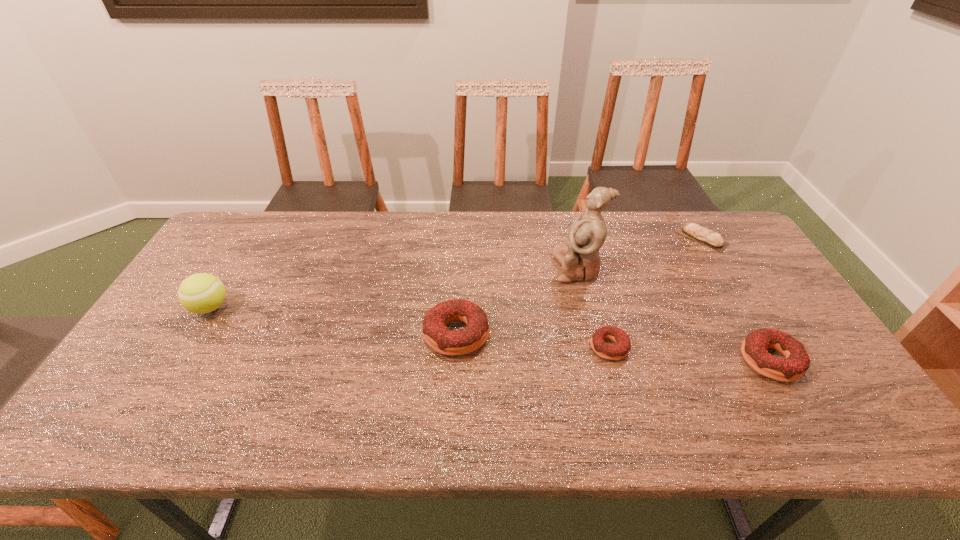
Identify which object is the closest to the shortest doughnut. Please provide its 2D coordinates. Your answer should be formatted as a tuple, i.e. [(x, y)], where the tuple contains the x and y coordinates of a point satisfying the conditions above.

[(579, 258)]

Select which object appears as the closest to the second tallest doughnut. Please provide its 2D coordinates. Your answer should be formatted as a tuple, i.e. [(x, y)], where the tuple contains the x and y coordinates of a point satisfying the conditions above.

[(612, 352)]

Choose which doughnut is the second nearest neighbor to the tallest object. Please provide its 2D coordinates. Your answer should be formatted as a tuple, i.e. [(x, y)], where the tuple contains the x and y coordinates of a point satisfying the conditions above.

[(436, 334)]

Identify which doughnut is the nearest to the shortest doughnut. Please provide its 2D coordinates. Your answer should be formatted as a tuple, i.e. [(x, y)], where the tuple contains the x and y coordinates of a point satisfying the conditions above.

[(436, 334)]

Where is `vacant area that satisfies the following two spatial constraints: 1. on the front-facing side of the tallest object; 2. on the front side of the tennis ball`? The width and height of the screenshot is (960, 540). vacant area that satisfies the following two spatial constraints: 1. on the front-facing side of the tallest object; 2. on the front side of the tennis ball is located at coordinates (588, 307).

Locate an element on the screen. vacant area in the image that satisfies the following two spatial constraints: 1. on the front-facing side of the figurine; 2. on the left side of the second doughnut from right to left is located at coordinates (597, 347).

Find the location of `vacant space that satisfies the following two spatial constraints: 1. on the front-facing side of the figurine; 2. on the back side of the rightmost doughnut`. vacant space that satisfies the following two spatial constraints: 1. on the front-facing side of the figurine; 2. on the back side of the rightmost doughnut is located at coordinates (601, 361).